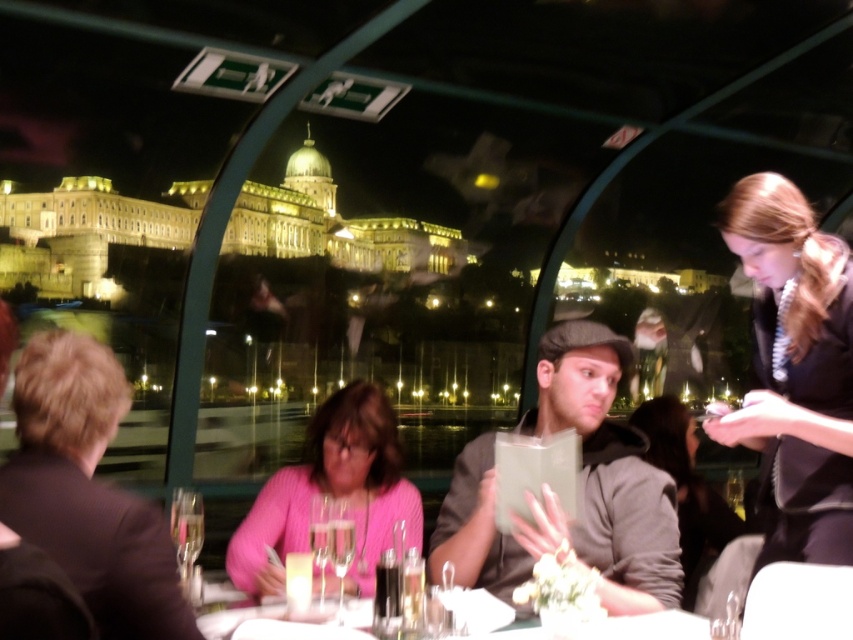
How far apart are smooth black dress at center and clear glass wine glass at center?

smooth black dress at center is 151.28 feet away from clear glass wine glass at center.

This screenshot has height=640, width=853. In order to click on smooth black dress at center in this screenshot , I will do `click(686, 486)`.

You are a GUI agent. You are given a task and a screenshot of the screen. Output one action in this format:
    pyautogui.click(x=<x>, y=<y>)
    Task: Click on the smooth black dress at center
    The width and height of the screenshot is (853, 640).
    Given the screenshot: What is the action you would take?
    pyautogui.click(x=686, y=486)

Identify the location of matte gray cap at center. Image resolution: width=853 pixels, height=640 pixels. (579, 486).

Who is more forward, (x=598, y=440) or (x=276, y=476)?

Point (x=598, y=440)

Image resolution: width=853 pixels, height=640 pixels. Find the location of `matte gray cap at center`. matte gray cap at center is located at coordinates (579, 486).

Is dark brown hair at right bigger than white glossy table at center?

Correct, dark brown hair at right is larger in size than white glossy table at center.

Is point (750, 259) closer to viewer compared to point (683, 627)?

No, it is not.

Where is `dark brown hair at right`? The image size is (853, 640). dark brown hair at right is located at coordinates (793, 369).